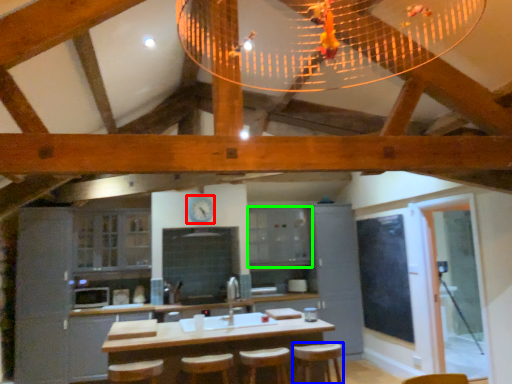
Question: Which object is the closest to the clock (highlighted by a red box)? Choose among these: bar stool (highlighted by a blue box) or cabinetry (highlighted by a green box).

Choices:
 (A) bar stool
 (B) cabinetry

Answer: (B)